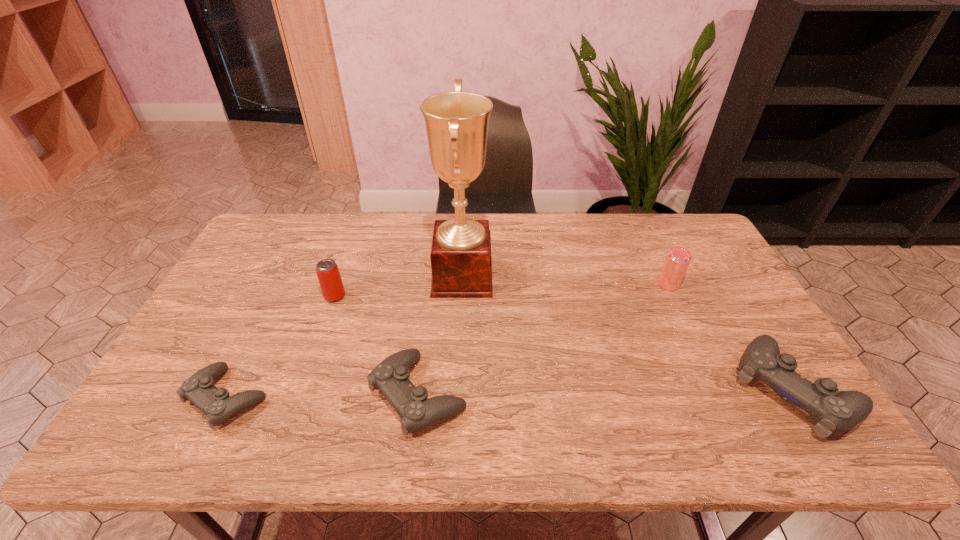
Please mark a free spot for a new control to balance the arrangement. Please provide its 2D coordinates. Your answer should be formatted as a tuple, i.e. [(x, y)], where the tuple contains the x and y coordinates of a point satisfying the conditions above.

[(607, 392)]